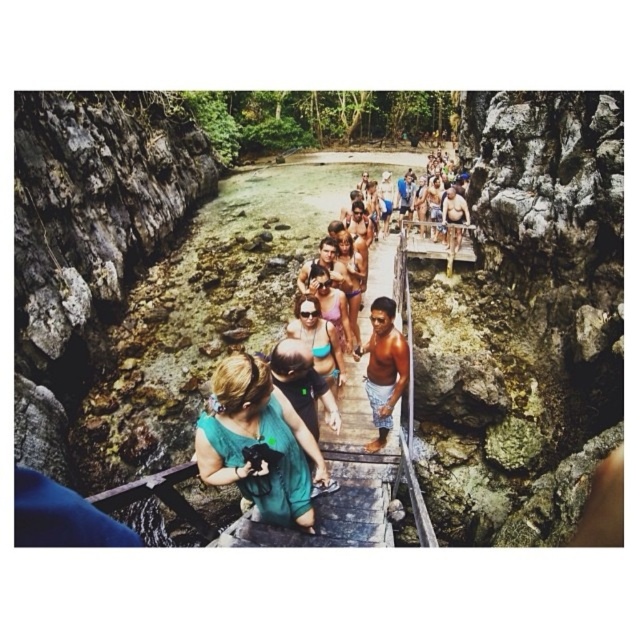
Question: Is teal fabric top at center thinner than matte pink bikini at center?

Choices:
 (A) no
 (B) yes

Answer: (A)

Question: Which of the following is the farthest from the observer?

Choices:
 (A) matte pink bikini at center
 (B) teal fabric top at center
 (C) shiny brown shorts at center

Answer: (A)

Question: Which point is closer to the camera taking this photo?

Choices:
 (A) (316, 291)
 (B) (285, 456)
 (C) (387, 339)

Answer: (B)

Question: Can you confirm if teal fabric top at center is positioned below matte pink bikini at center?

Choices:
 (A) no
 (B) yes

Answer: (B)

Question: Does shiny brown shorts at center appear on the right side of matte pink bikini at center?

Choices:
 (A) yes
 (B) no

Answer: (A)

Question: Which object is farther from the camera taking this photo?

Choices:
 (A) matte pink bikini at center
 (B) shiny brown shorts at center

Answer: (A)